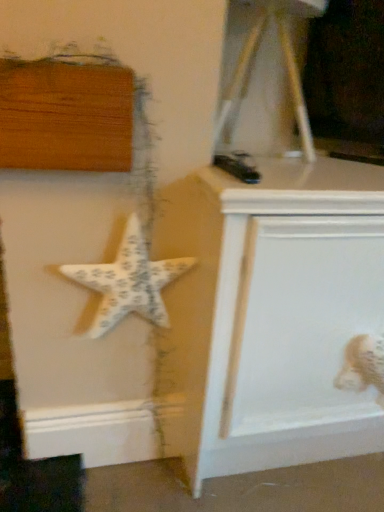
Where is `white textured starfish at center-left`? This screenshot has height=512, width=384. white textured starfish at center-left is located at coordinates (128, 281).

This screenshot has height=512, width=384. Identify the location of starfish behind the white painted wood vanity at center. (128, 281).

Considering the relative positions of white textured starfish at center-left and white painted wood vanity at center in the image provided, is white textured starfish at center-left in front of white painted wood vanity at center?

No.

Could you tell me if white textured starfish at center-left is facing white painted wood vanity at center?

No, white textured starfish at center-left is not oriented towards white painted wood vanity at center.

How different are the orientations of white textured starfish at center-left and white painted wood vanity at center in degrees?

The angle between the facing direction of white textured starfish at center-left and the facing direction of white painted wood vanity at center is 1.23 degrees.

Does white painted wood vanity at center have a larger size compared to white textured starfish at center-left?

Indeed, white painted wood vanity at center has a larger size compared to white textured starfish at center-left.

Which is correct: white painted wood vanity at center is inside white textured starfish at center-left, or outside of it?

white painted wood vanity at center is spatially situated outside white textured starfish at center-left.

Is there a large distance between white painted wood vanity at center and white textured starfish at center-left?

No, there isn't a large distance between white painted wood vanity at center and white textured starfish at center-left.

Is white painted wood vanity at center turned away from white textured starfish at center-left?

No, white painted wood vanity at center is not facing away from white textured starfish at center-left.

Are white fabric toy at lower right and white textured starfish at center-left located far from each other?

No.

Could you tell me if white fabric toy at lower right is turned towards white textured starfish at center-left?

No, white fabric toy at lower right is not facing towards white textured starfish at center-left.

Is white fabric toy at lower right taller than white textured starfish at center-left?

No, white fabric toy at lower right is not taller than white textured starfish at center-left.

Is white painted wood vanity at center bigger than white fabric toy at lower right?

Correct, white painted wood vanity at center is larger in size than white fabric toy at lower right.

Which is further, (376, 270) or (364, 370)?

Point (364, 370)

Does white painted wood vanity at center have a lesser width compared to white fabric toy at lower right?

No, white painted wood vanity at center is not thinner than white fabric toy at lower right.

In the scene shown: Is the surface of white painted wood vanity at center in direct contact with white fabric toy at lower right?

white painted wood vanity at center is not next to white fabric toy at lower right, and they're not touching.

Is white fabric toy at lower right oriented towards white painted wood vanity at center?

Yes, white fabric toy at lower right faces towards white painted wood vanity at center.

Considering the positions of objects white fabric toy at lower right and white painted wood vanity at center in the image provided, who is more to the left, white fabric toy at lower right or white painted wood vanity at center?

Positioned to the left is white painted wood vanity at center.

From a real-world perspective, is white fabric toy at lower right below white painted wood vanity at center?

Incorrect, from a real-world perspective, white fabric toy at lower right is higher than white painted wood vanity at center.

Does white textured starfish at center-left come behind white fabric toy at lower right?

No, white textured starfish at center-left is closer to the viewer.

Is white fabric toy at lower right located within white textured starfish at center-left?

No.

Is white textured starfish at center-left at the left side of white fabric toy at lower right?

Yes.

Considering the relative sizes of white textured starfish at center-left and white fabric toy at lower right in the image provided, is white textured starfish at center-left thinner than white fabric toy at lower right?

No, white textured starfish at center-left is not thinner than white fabric toy at lower right.

At what (x,y) coordinates should I click in order to perform the action: click on vanity below the white textured starfish at center-left (from the image's perspective). Please return your answer as a coordinate pair (x, y). This screenshot has width=384, height=512. Looking at the image, I should click on (271, 315).

At what (x,y) coordinates should I click in order to perform the action: click on vanity that is in front of the white textured starfish at center-left. Please return your answer as a coordinate pair (x, y). This screenshot has width=384, height=512. Looking at the image, I should click on (271, 315).

Estimate the real-world distances between objects in this image. Which object is further from white textured starfish at center-left, white painted wood vanity at center or white fabric toy at lower right?

The object further to white textured starfish at center-left is white fabric toy at lower right.

Looking at the image, which one is located closer to white fabric toy at lower right, white painted wood vanity at center or white textured starfish at center-left?

white painted wood vanity at center is positioned closer to the anchor white fabric toy at lower right.

Which object lies further to the anchor point white painted wood vanity at center, white textured starfish at center-left or white fabric toy at lower right?

white fabric toy at lower right lies further to white painted wood vanity at center than the other object.

Considering their positions, is white textured starfish at center-left positioned closer to white fabric toy at lower right than white painted wood vanity at center?

Based on the image, white painted wood vanity at center appears to be nearer to white fabric toy at lower right.

When comparing their distances from white painted wood vanity at center, does white fabric toy at lower right or white textured starfish at center-left seem further?

white fabric toy at lower right is positioned further to the anchor white painted wood vanity at center.

Considering their positions, is white fabric toy at lower right positioned closer to white textured starfish at center-left than white painted wood vanity at center?

Based on the image, white painted wood vanity at center appears to be nearer to white textured starfish at center-left.

You are a GUI agent. You are given a task and a screenshot of the screen. Output one action in this format:
    pyautogui.click(x=<x>, y=<y>)
    Task: Click on the vanity situated between white textured starfish at center-left and white fabric toy at lower right from left to right
    
    Given the screenshot: What is the action you would take?
    pyautogui.click(x=271, y=315)